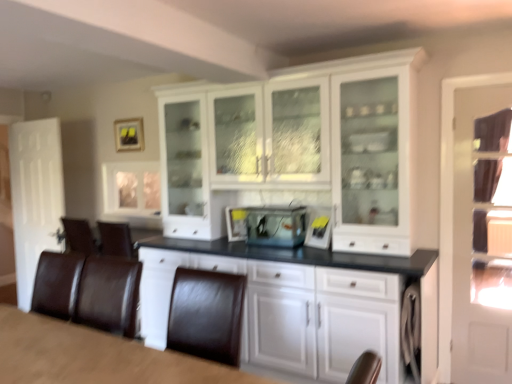
What are the coordinates of `empty space that is ontop of brown leather table at lower left` in the screenshot? It's located at (64, 356).